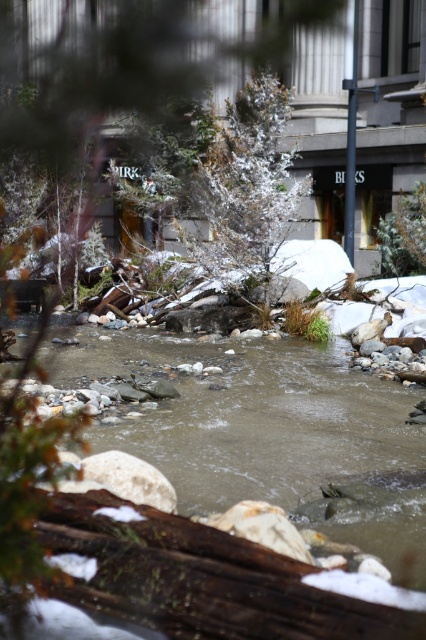
Who is higher up, brown rough log at lower center or snow-covered evergreen at center?

Positioned higher is snow-covered evergreen at center.

Does brown rough log at lower center have a larger size compared to snow-covered evergreen at center?

Yes.

Describe the element at coordinates (201, 579) in the screenshot. This screenshot has height=640, width=426. I see `brown rough log at lower center` at that location.

The height and width of the screenshot is (640, 426). What are the coordinates of `brown rough log at lower center` in the screenshot? It's located at (201, 579).

Does smooth rock stream at center appear on the left side of brown rough log at lower center?

Yes, smooth rock stream at center is to the left of brown rough log at lower center.

Which is above, smooth rock stream at center or brown rough log at lower center?

Positioned higher is smooth rock stream at center.

Which is behind, point (60, 326) or point (169, 534)?

The point (60, 326) is more distant.

At what (x,y) coordinates should I click in order to perform the action: click on smooth rock stream at center. Please return your answer as a coordinate pair (x, y). The image size is (426, 640). Looking at the image, I should click on (259, 428).

Which is behind, point (400, 387) or point (81, 97)?

The point (81, 97) is behind.

Does smooth rock stream at center appear on the right side of snow-covered evergreen tree at center?

Correct, you'll find smooth rock stream at center to the right of snow-covered evergreen tree at center.

Does point (379, 524) come behind point (8, 22)?

No.

Locate an element on the screen. smooth rock stream at center is located at coordinates (259, 428).